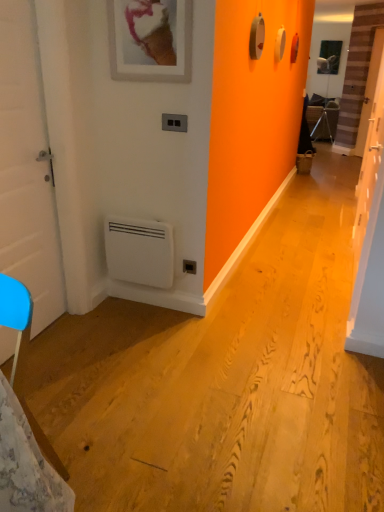
Question: Does white matte door at left, which is counted as the 2th door, starting from the right, have a lesser width compared to black plastic/light switch at upper center?

Choices:
 (A) yes
 (B) no

Answer: (B)

Question: From a real-world perspective, does white matte door at left, acting as the first door starting from the left, sit lower than black plastic/light switch at upper center?

Choices:
 (A) no
 (B) yes

Answer: (B)

Question: Does white matte door at left, acting as the first door starting from the left, have a larger size compared to black plastic/light switch at upper center?

Choices:
 (A) no
 (B) yes

Answer: (B)

Question: From the image's perspective, is white matte door at left, which is counted as the 2th door, starting from the right, on black plastic/light switch at upper center?

Choices:
 (A) no
 (B) yes

Answer: (A)

Question: Is white matte door at left, acting as the first door starting from the left, at the left side of black plastic/light switch at upper center?

Choices:
 (A) no
 (B) yes

Answer: (B)

Question: Considering the positions of white matte door at left, acting as the first door starting from the left, and black plastic/light switch at upper center in the image, is white matte door at left, acting as the first door starting from the left, bigger or smaller than black plastic/light switch at upper center?

Choices:
 (A) big
 (B) small

Answer: (A)

Question: Looking at their shapes, would you say white matte door at left, which is counted as the 2th door, starting from the right, is wider or thinner than black plastic/light switch at upper center?

Choices:
 (A) wide
 (B) thin

Answer: (A)

Question: From the image's perspective, is white matte door at left, which is counted as the 2th door, starting from the right, located above or below black plastic/light switch at upper center?

Choices:
 (A) below
 (B) above

Answer: (A)

Question: In terms of height, does white matte door at left, which is counted as the 2th door, starting from the right, look taller or shorter compared to black plastic/light switch at upper center?

Choices:
 (A) short
 (B) tall

Answer: (B)

Question: In the image, is white matte door at left, which is counted as the 2th door, starting from the right, positioned in front of or behind white plastic air conditioning unit at lower left?

Choices:
 (A) behind
 (B) front

Answer: (B)

Question: From a real-world perspective, is white matte door at left, which is counted as the 2th door, starting from the right, above or below white plastic air conditioning unit at lower left?

Choices:
 (A) above
 (B) below

Answer: (A)

Question: From the image's perspective, relative to white plastic air conditioning unit at lower left, is white matte door at left, which is counted as the 2th door, starting from the right, above or below?

Choices:
 (A) below
 (B) above

Answer: (B)

Question: Looking at their shapes, would you say white matte door at left, which is counted as the 2th door, starting from the right, is wider or thinner than white plastic air conditioning unit at lower left?

Choices:
 (A) thin
 (B) wide

Answer: (B)

Question: Is point (188, 270) positioned closer to the camera than point (3, 152)?

Choices:
 (A) closer
 (B) farther

Answer: (B)

Question: Is black plastic electric outlet at lower center in front of or behind white matte door at left, acting as the first door starting from the left, in the image?

Choices:
 (A) behind
 (B) front

Answer: (A)